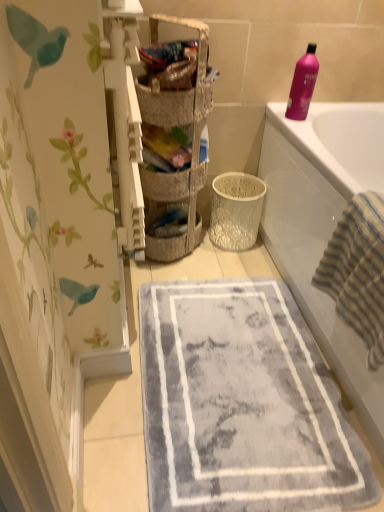
Question: Considering the relative positions of textured wicker basket at center, placed as the 1th basket when sorted from back to front, and woven fabric basket at upper center, arranged as the 1th basket when viewed from the front, in the image provided, is textured wicker basket at center, placed as the 1th basket when sorted from back to front, in front of woven fabric basket at upper center, arranged as the 1th basket when viewed from the front,?

Choices:
 (A) no
 (B) yes

Answer: (A)

Question: Can you confirm if textured wicker basket at center, which ranks as the 2th basket in front-to-back order, is positioned to the right of woven fabric basket at upper center, arranged as the 1th basket when viewed from the front?

Choices:
 (A) no
 (B) yes

Answer: (A)

Question: Would you say textured wicker basket at center, placed as the 1th basket when sorted from back to front, is outside woven fabric basket at upper center, arranged as the 1th basket when viewed from the front?

Choices:
 (A) no
 (B) yes

Answer: (B)

Question: From a real-world perspective, is textured wicker basket at center, which ranks as the 2th basket in front-to-back order, physically below woven fabric basket at upper center, placed as the second basket when sorted from back to front?

Choices:
 (A) no
 (B) yes

Answer: (B)

Question: Is textured wicker basket at center, which ranks as the 2th basket in front-to-back order, not near woven fabric basket at upper center, arranged as the 1th basket when viewed from the front?

Choices:
 (A) no
 (B) yes

Answer: (A)

Question: In terms of height, does pink glossy bottle at upper right look taller or shorter compared to woven fabric basket at upper center, arranged as the 1th basket when viewed from the front?

Choices:
 (A) short
 (B) tall

Answer: (B)

Question: Is pink glossy bottle at upper right inside the boundaries of woven fabric basket at upper center, placed as the second basket when sorted from back to front, or outside?

Choices:
 (A) inside
 (B) outside

Answer: (B)

Question: Considering the positions of pink glossy bottle at upper right and woven fabric basket at upper center, arranged as the 1th basket when viewed from the front, in the image, is pink glossy bottle at upper right wider or thinner than woven fabric basket at upper center, arranged as the 1th basket when viewed from the front,?

Choices:
 (A) wide
 (B) thin

Answer: (B)

Question: Is point (317, 74) closer or farther from the camera than point (200, 78)?

Choices:
 (A) closer
 (B) farther

Answer: (B)

Question: Considering the positions of gray plush bath mat at center and striped cotton beach towel at right in the image, is gray plush bath mat at center wider or thinner than striped cotton beach towel at right?

Choices:
 (A) thin
 (B) wide

Answer: (B)

Question: Considering their positions, is gray plush bath mat at center located in front of or behind striped cotton beach towel at right?

Choices:
 (A) behind
 (B) front

Answer: (A)

Question: From the image's perspective, is gray plush bath mat at center positioned above or below striped cotton beach towel at right?

Choices:
 (A) above
 (B) below

Answer: (B)

Question: Choose the correct answer: Is gray plush bath mat at center inside striped cotton beach towel at right or outside it?

Choices:
 (A) inside
 (B) outside

Answer: (B)

Question: Is textured wicker basket at center, which ranks as the 2th basket in front-to-back order, inside or outside of striped cotton beach towel at right?

Choices:
 (A) outside
 (B) inside

Answer: (A)

Question: Considering the positions of textured wicker basket at center, placed as the 1th basket when sorted from back to front, and striped cotton beach towel at right in the image, is textured wicker basket at center, placed as the 1th basket when sorted from back to front, bigger or smaller than striped cotton beach towel at right?

Choices:
 (A) big
 (B) small

Answer: (B)